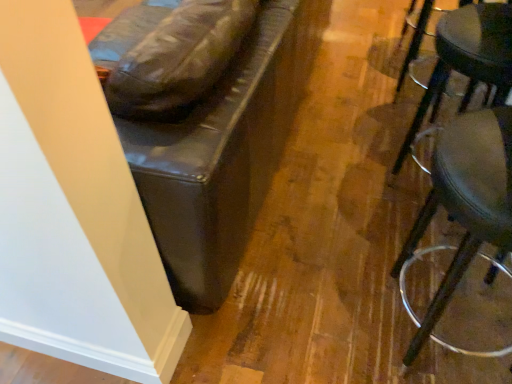
Question: From the image's perspective, is metallic silver stool at right, the 1th stool positioned from the top, beneath metallic silver stool at right, which ranks as the 2th stool in top-to-bottom order?

Choices:
 (A) yes
 (B) no

Answer: (B)

Question: Is metallic silver stool at right, the 1th stool positioned from the top, positioned with its back to metallic silver stool at right, positioned as the 1th stool in bottom-to-top order?

Choices:
 (A) no
 (B) yes

Answer: (A)

Question: Is metallic silver stool at right, the 1th stool positioned from the top, taller than metallic silver stool at right, positioned as the 1th stool in bottom-to-top order?

Choices:
 (A) no
 (B) yes

Answer: (A)

Question: Is metallic silver stool at right, the 1th stool positioned from the top, behind metallic silver stool at right, which ranks as the 2th stool in top-to-bottom order?

Choices:
 (A) no
 (B) yes

Answer: (B)

Question: Are metallic silver stool at right, the 1th stool positioned from the top, and metallic silver stool at right, which ranks as the 2th stool in top-to-bottom order, located far from each other?

Choices:
 (A) yes
 (B) no

Answer: (B)

Question: Is the depth of metallic silver stool at right, acting as the second stool starting from the bottom, less than that of metallic silver stool at right, positioned as the 1th stool in bottom-to-top order?

Choices:
 (A) no
 (B) yes

Answer: (A)

Question: Is metallic silver stool at right, positioned as the 1th stool in bottom-to-top order, bigger than metallic silver stool at right, the 1th stool positioned from the top?

Choices:
 (A) yes
 (B) no

Answer: (A)

Question: Can you confirm if metallic silver stool at right, positioned as the 1th stool in bottom-to-top order, is smaller than metallic silver stool at right, acting as the second stool starting from the bottom?

Choices:
 (A) yes
 (B) no

Answer: (B)

Question: Is metallic silver stool at right, which ranks as the 2th stool in top-to-bottom order, positioned with its back to metallic silver stool at right, acting as the second stool starting from the bottom?

Choices:
 (A) no
 (B) yes

Answer: (A)

Question: Is metallic silver stool at right, which ranks as the 2th stool in top-to-bottom order, outside of metallic silver stool at right, acting as the second stool starting from the bottom?

Choices:
 (A) no
 (B) yes

Answer: (B)

Question: Is metallic silver stool at right, which ranks as the 2th stool in top-to-bottom order, far away from metallic silver stool at right, acting as the second stool starting from the bottom?

Choices:
 (A) no
 (B) yes

Answer: (A)

Question: Considering the relative positions of metallic silver stool at right, which ranks as the 2th stool in top-to-bottom order, and metallic silver stool at right, the 1th stool positioned from the top, in the image provided, is metallic silver stool at right, which ranks as the 2th stool in top-to-bottom order, to the left of metallic silver stool at right, the 1th stool positioned from the top, from the viewer's perspective?

Choices:
 (A) no
 (B) yes

Answer: (B)

Question: From the image's perspective, is metallic silver stool at right, acting as the second stool starting from the bottom, positioned above or below metallic silver stool at right, which ranks as the 2th stool in top-to-bottom order?

Choices:
 (A) above
 (B) below

Answer: (A)